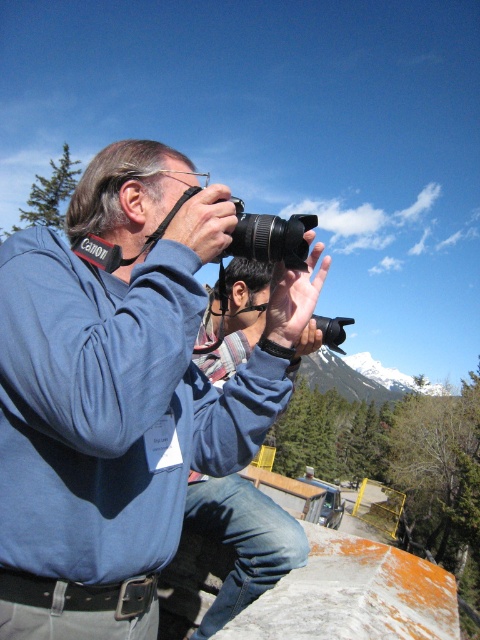
You are a photographer trying to set up your equipment. You have a matte blue sweatshirt at center and a black plastic camera at center. If your backpack is 1.5 meters wide, can you place both items side by side inside it without overlapping?

The matte blue sweatshirt at center and black plastic camera at center are 1.39 meters apart from each other. Since the backpack is 1.5 meters wide, which is wider than the combined space needed for both items, yes, you can place both items side by side inside the backpack without overlapping.

You are a photographer who needs to store your equipment. You have a storage box that can only fit items smaller than the blue fabric shirt at center. Can the black plastic camera at center fit in the box?

The blue fabric shirt at center has a smaller size compared to black plastic camera at center. Since the storage box can only fit items smaller than the blue fabric shirt at center, the black plastic camera at center cannot fit in the box because it is larger than the shirt.

You are a photographer standing at the point marked by the coordinates point (241, 540). You want to take a photo of the snowcapped mountains in the background. Is the blue fabric shirt at center blocking your view?

The point (241, 540) corresponds to the blue fabric shirt at center, so yes, the blue fabric shirt at center is blocking your view.